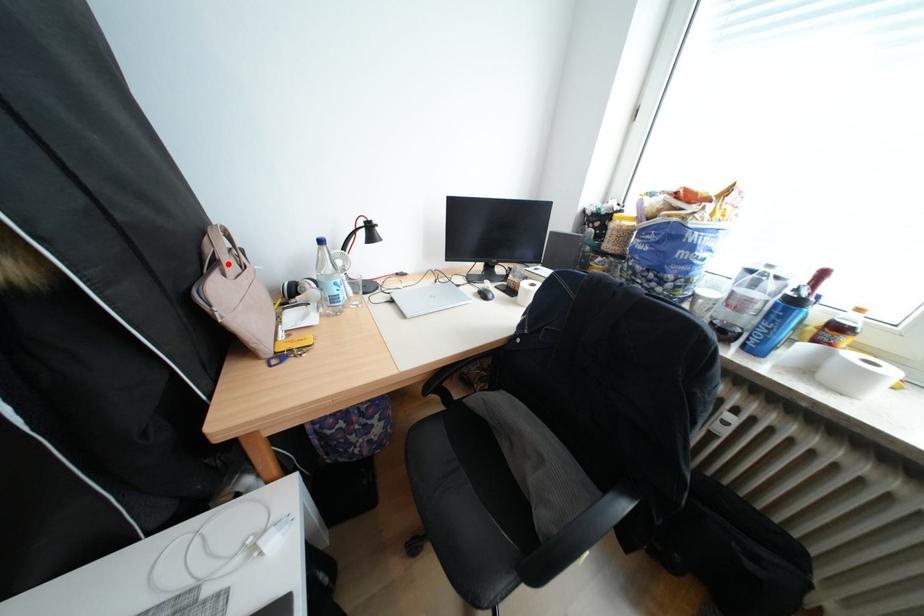
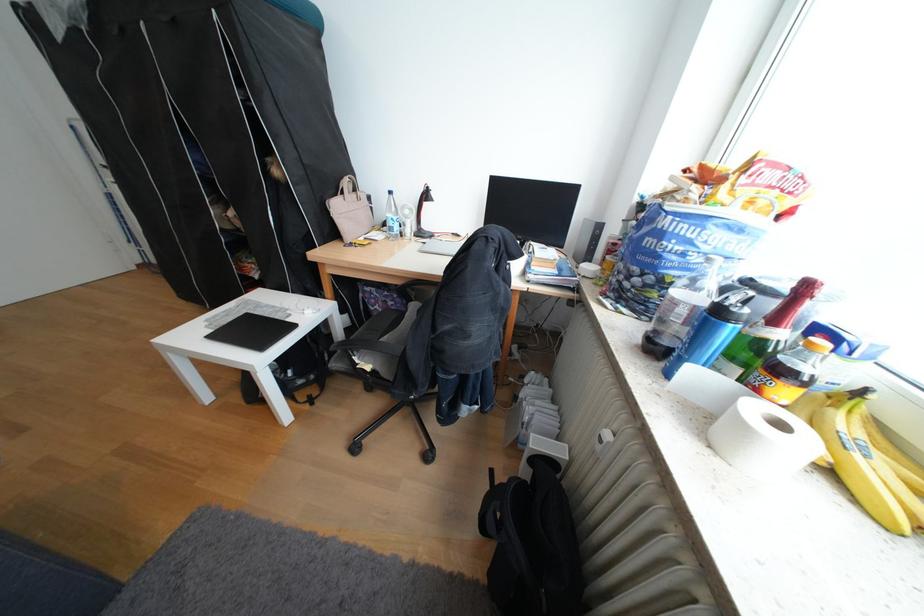
Where in the second image is the point corresponding to the highlighted location from the first image?

(355, 193)